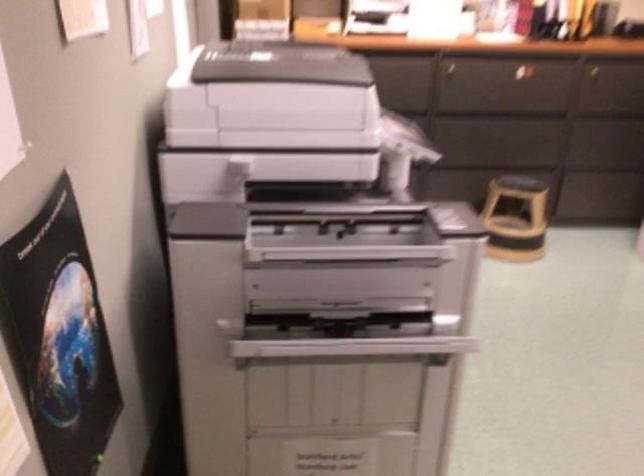
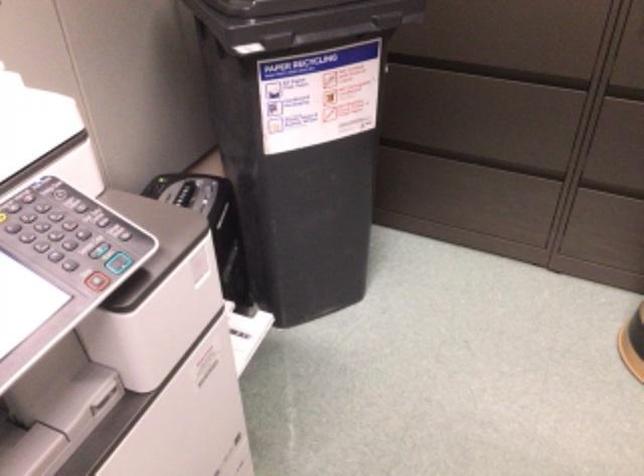
Where in the second image is the point corresponding to (x=393, y=113) from the first image?

(507, 73)